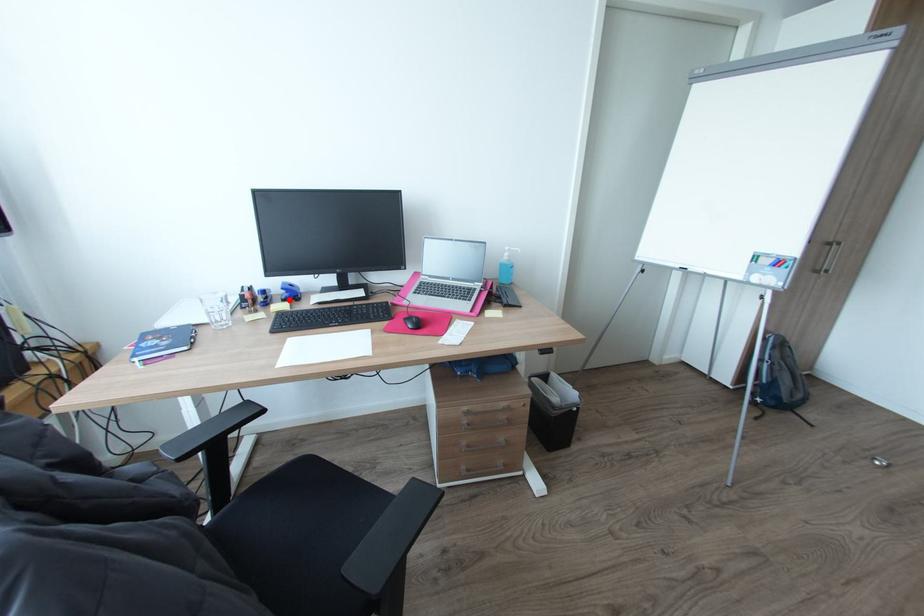
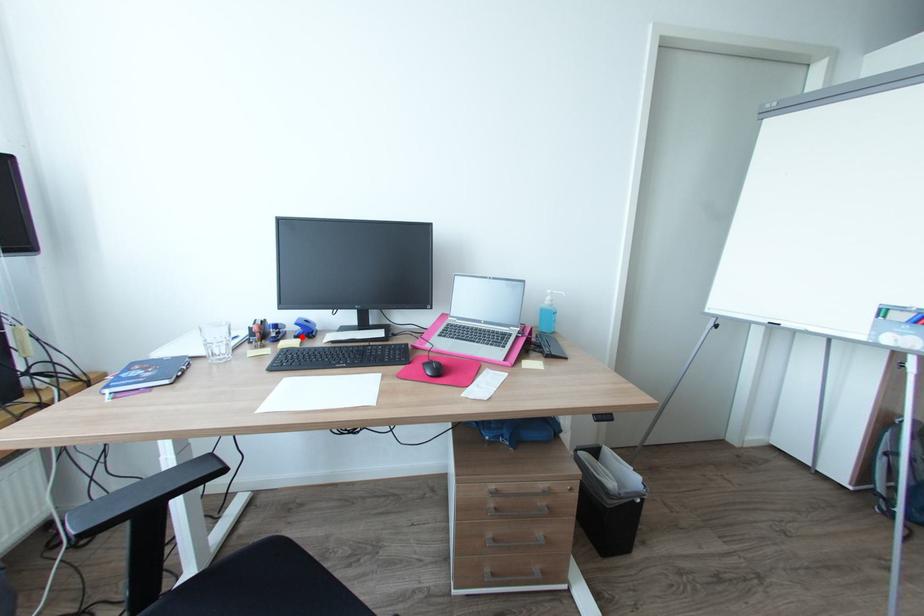
I am providing you with two images of the same scene from different viewpoints. A red point is marked on the first image and another point is marked on the second image. Is the marked point in image1 the same physical position as the marked point in image2?

Yes